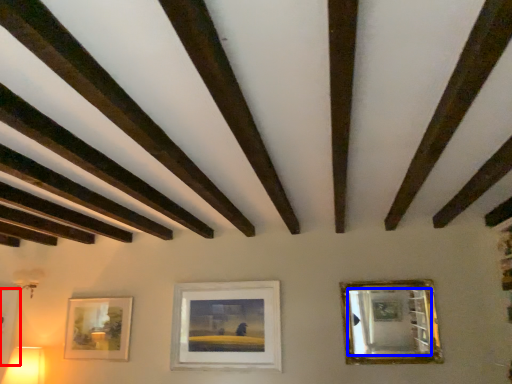
Question: Which object appears farthest to the camera in this image, picture frame (highlighted by a red box) or mirror (highlighted by a blue box)?

Choices:
 (A) picture frame
 (B) mirror

Answer: (A)